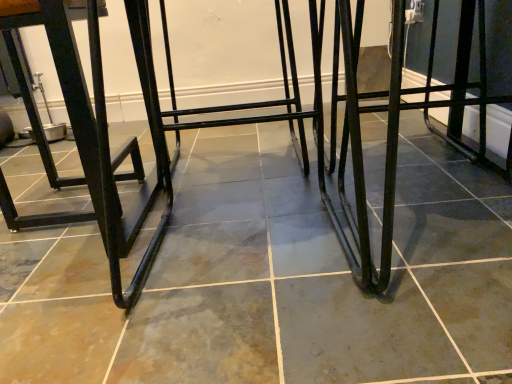
This screenshot has width=512, height=384. Describe the element at coordinates (361, 142) in the screenshot. I see `black metal step stool at center` at that location.

Image resolution: width=512 pixels, height=384 pixels. I want to click on black metal step stool at center, so click(x=361, y=142).

What do you see at coordinates (67, 111) in the screenshot?
I see `black metal frame at left` at bounding box center [67, 111].

Where is `black metal frame at left`? This screenshot has width=512, height=384. black metal frame at left is located at coordinates (67, 111).

Locate an element on the screen. black metal step stool at center is located at coordinates (361, 142).

Based on the photo, can you confirm if black metal step stool at center is positioned to the left of black metal frame at left?

No.

Which object is closer to the camera taking this photo, black metal step stool at center or black metal frame at left?

Positioned in front is black metal step stool at center.

Between point (335, 26) and point (124, 297), which one is positioned in front?

The point (124, 297) is more forward.

From the image's perspective, who appears lower, black metal step stool at center or black metal frame at left?

black metal step stool at center is shown below in the image.

Looking at this image, from a real-world perspective, which is physically below, black metal step stool at center or black metal frame at left?

black metal step stool at center, from a real-world perspective.

Between black metal step stool at center and black metal frame at left, which one has smaller width?

Thinner between the two is black metal frame at left.

Is black metal step stool at center taller or shorter than black metal frame at left?

Clearly, black metal step stool at center is shorter compared to black metal frame at left.

Can you confirm if black metal step stool at center is bigger than black metal frame at left?

Yes.

Is black metal frame at left completely or partially inside black metal step stool at center?

No, black metal step stool at center does not contain black metal frame at left.

Does black metal step stool at center touch black metal frame at left?

black metal step stool at center and black metal frame at left are clearly separated.

Is black metal step stool at center turned away from black metal frame at left?

No, black metal frame at left is not at the back of black metal step stool at center.

There is a black metal step stool at center. Identify the location of furniture above it (from a real-world perspective). (67, 111).

Would you say black metal frame at left is to the left or to the right of black metal step stool at center in the picture?

Clearly, black metal frame at left is on the left of black metal step stool at center in the image.

Is black metal frame at left further to camera compared to black metal step stool at center?

Yes, black metal frame at left is behind black metal step stool at center.

Does point (139, 158) come closer to viewer compared to point (387, 226)?

No, it is not.

From the image's perspective, is black metal frame at left located above black metal step stool at center?

Yes.

Looking at this image, from a real-world perspective, is black metal frame at left beneath black metal step stool at center?

No, from a real-world perspective, black metal frame at left is not beneath black metal step stool at center.

Considering the sizes of black metal frame at left and black metal step stool at center in the image, is black metal frame at left wider or thinner than black metal step stool at center?

black metal frame at left is thinner than black metal step stool at center.

Does black metal frame at left have a lesser height compared to black metal step stool at center?

In fact, black metal frame at left may be taller than black metal step stool at center.

Which of these two, black metal frame at left or black metal step stool at center, is bigger?

Bigger between the two is black metal step stool at center.

Is black metal frame at left located outside black metal step stool at center?

That's correct, black metal frame at left is outside of black metal step stool at center.

Is black metal frame at left touching black metal step stool at center?

There is a gap between black metal frame at left and black metal step stool at center.

Is black metal frame at left oriented away from black metal step stool at center?

No, black metal step stool at center is not at the back of black metal frame at left.

How many degrees apart are the facing directions of black metal frame at left and black metal step stool at center?

They differ by 87.7 degrees in their facing directions.

Locate an element on the screen. Image resolution: width=512 pixels, height=384 pixels. furniture behind the black metal step stool at center is located at coordinates (67, 111).

Locate an element on the screen. This screenshot has width=512, height=384. furniture that is above the black metal step stool at center (from a real-world perspective) is located at coordinates (67, 111).

Where is `step stool below the black metal frame at left (from the image's perspective)`? step stool below the black metal frame at left (from the image's perspective) is located at coordinates (361, 142).